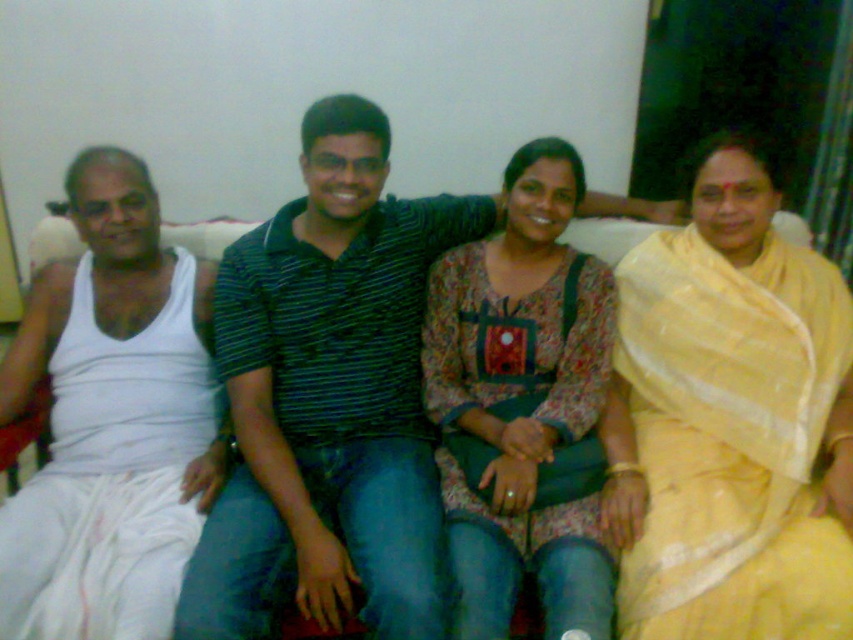
Question: Which object appears closest to the camera in this image?

Choices:
 (A) floral-patterned fabric at center
 (B) yellow silk saree at right

Answer: (A)

Question: Which point is closer to the camera taking this photo?

Choices:
 (A) click(735, 332)
 (B) click(543, 362)

Answer: (A)

Question: Which object is farther from the camera taking this photo?

Choices:
 (A) yellow silk saree at right
 (B) white cotton saree at left

Answer: (A)

Question: Where is yellow silk saree at right located in relation to white cotton saree at left in the image?

Choices:
 (A) above
 (B) below

Answer: (A)

Question: Does white cotton saree at left have a larger size compared to floral-patterned fabric at center?

Choices:
 (A) no
 (B) yes

Answer: (A)

Question: Does white cotton saree at left appear over floral-patterned fabric at center?

Choices:
 (A) yes
 (B) no

Answer: (B)